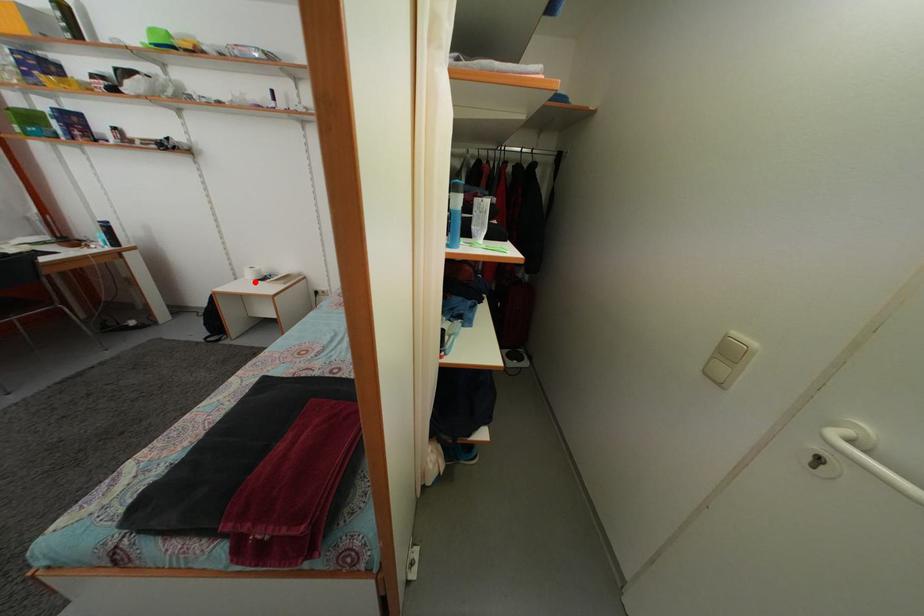
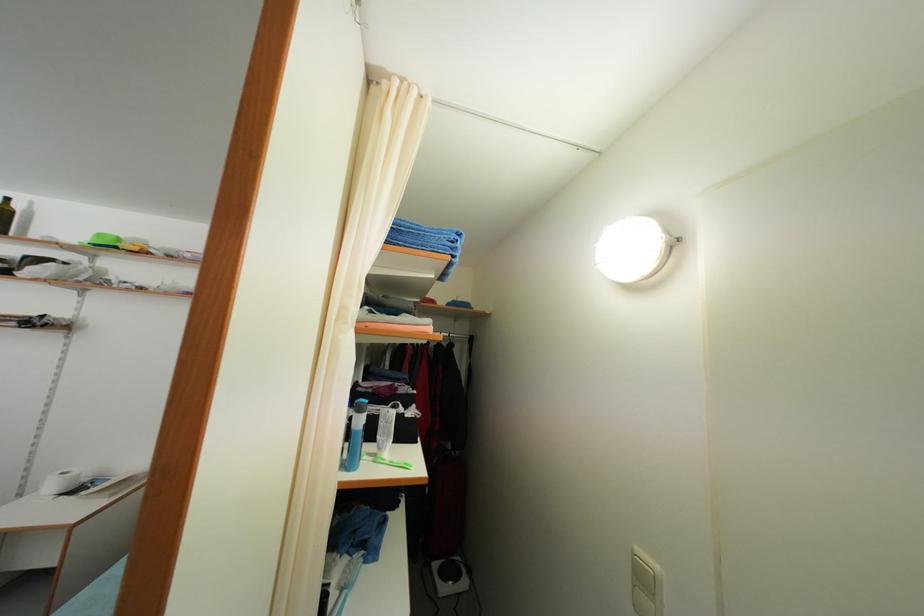
Question: I am providing you with two images of the same scene from different viewpoints. A red point is marked on the first image. Is the red point's position out of view in image 2?

Choices:
 (A) Yes
 (B) No

Answer: (B)